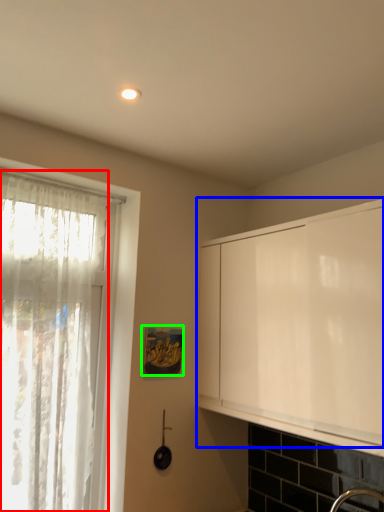
Question: Which is nearer to the curtain (highlighted by a red box)? cabinetry (highlighted by a blue box) or picture frame (highlighted by a green box).

Choices:
 (A) cabinetry
 (B) picture frame

Answer: (B)